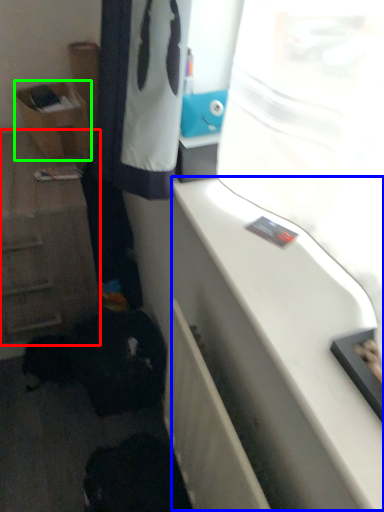
Question: Based on their relative distances, which object is nearer to cabinetry (highlighted by a red box)? Choose from counter top (highlighted by a blue box) and shelf (highlighted by a green box).

Choices:
 (A) counter top
 (B) shelf

Answer: (B)